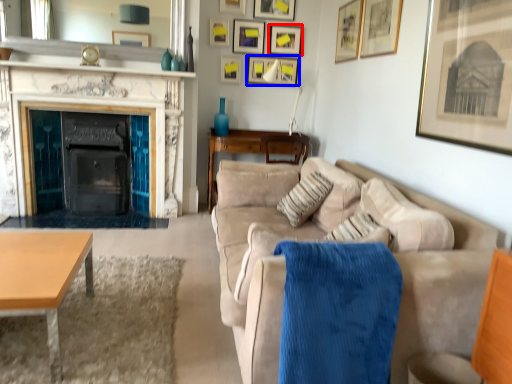
Question: Which object is further to the camera taking this photo, picture frame (highlighted by a red box) or picture frame (highlighted by a blue box)?

Choices:
 (A) picture frame
 (B) picture frame

Answer: (B)